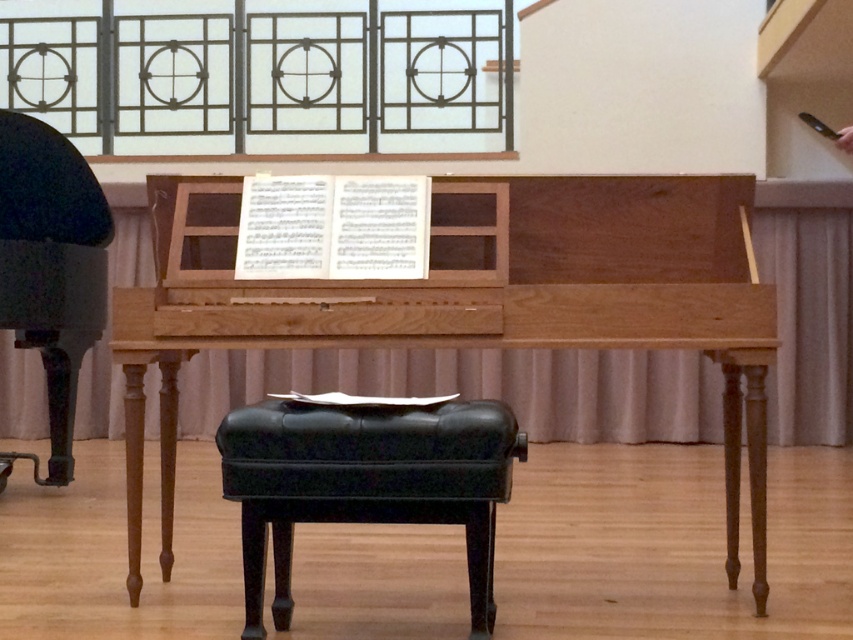
You are a musician trying to place a music stand between the natural wood piano at center and the black leather stool at center. Given that the music stand requires 30 cm of space, can you determine if there is enough space between them?

The natural wood piano at center has a larger size compared to black leather stool at center, but the exact distance between them isn not specified. Therefore, it is uncertain whether there is enough space for the music stand requiring 30 cm.

You are standing in a room with a natural wood piano at center. You want to place a 10 feet long ladder against the wall behind the piano. Is there enough space between you and the piano to safely position the ladder without it touching the piano?

The distance between you and the natural wood piano at center is 9.74 feet, which is less than the ladder length of 10 feet. Therefore, there isn not enough space to safely position the ladder without it touching the piano.

Where is the natural wood piano at center located in the image?

The natural wood piano at center is located at point (473, 300) in the image.